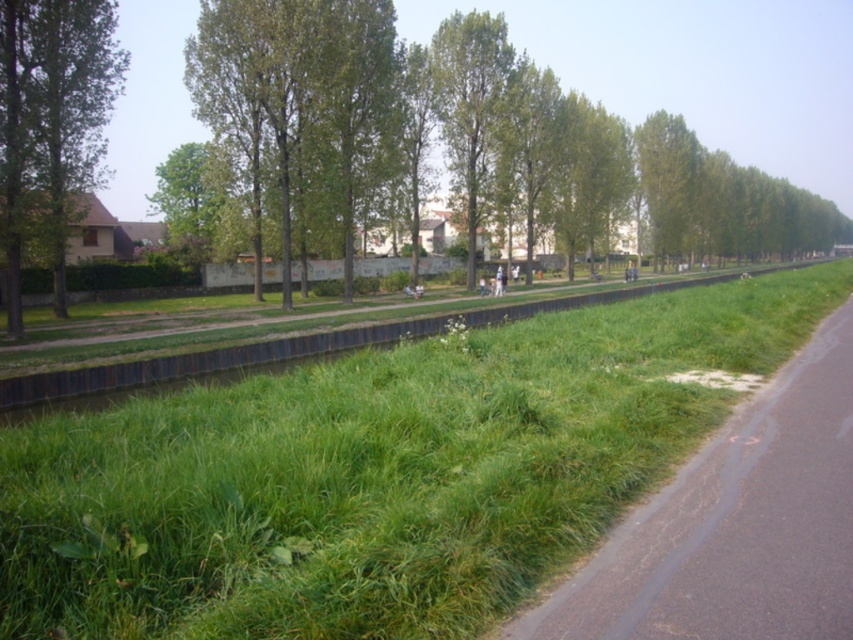
You are standing on the paved path and want to walk to the green grass at center. Which direction should you go relative to the green leafy tree at upper left?

The green grass at center is positioned under the green leafy tree at upper left, so you should walk towards the base of the green leafy tree at upper left to reach the green grass at center.

You are standing on the paved path and want to determine which object is shorter between the green grass at lower right and the green leafy tree at upper left. Based on the scene, which one is shorter?

The green grass at lower right is shorter than the green leafy tree at upper left.

You are a gardener who needs to mow the green grass at center and trim the green leafy tree at upper left. Which task should you tackle first if you want to start with the shorter one?

The green grass at center is shorter than the green leafy tree at upper left, so you should mow the green grass at center first.